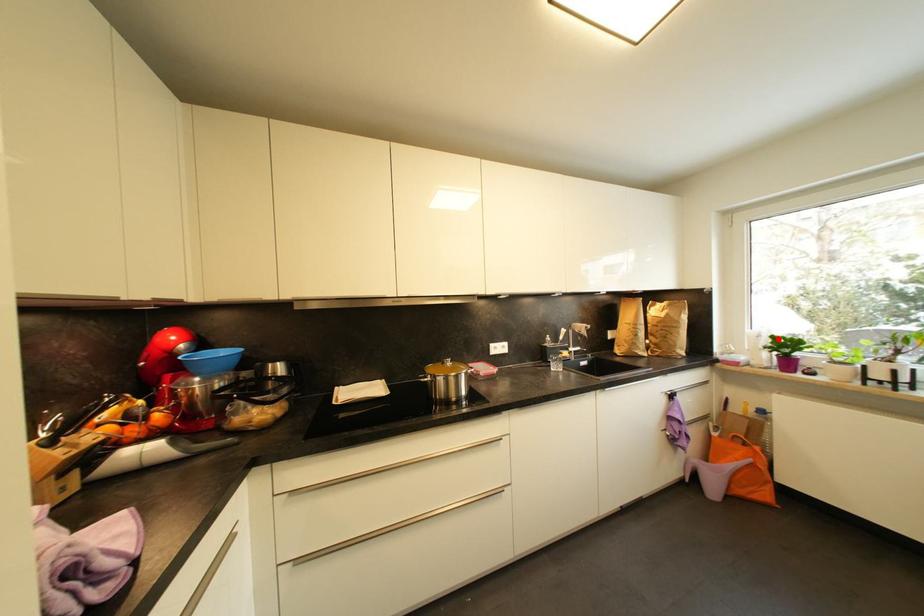
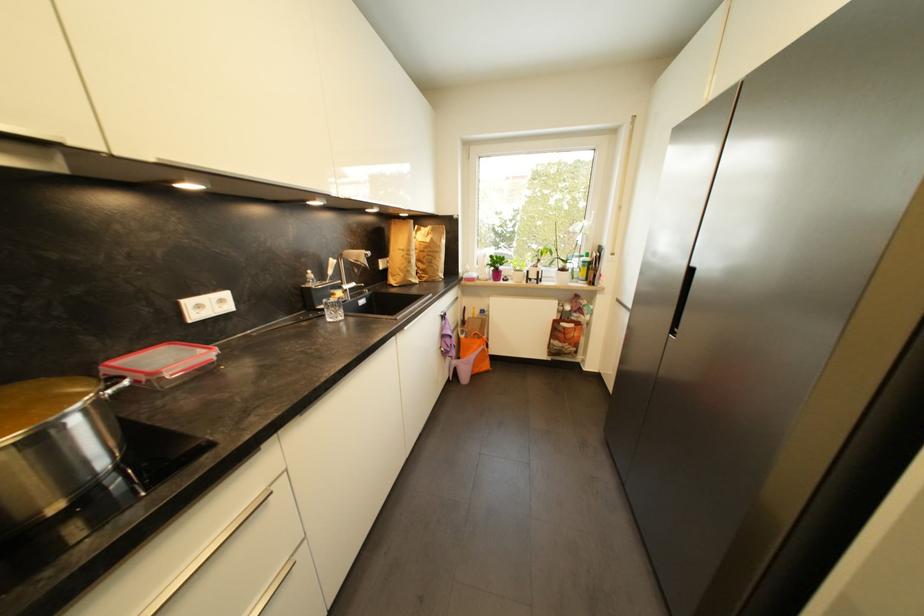
Where in the second image is the point corresponding to the highlighted location from the first image?

(495, 257)